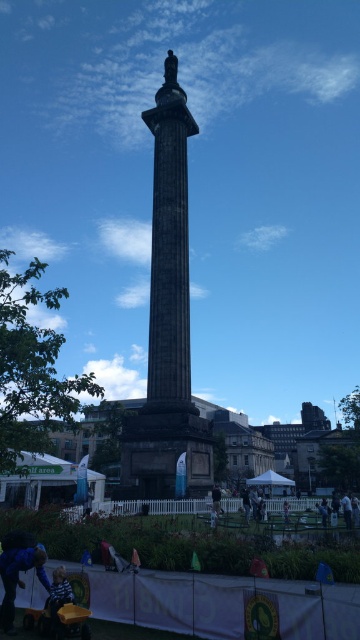
In the scene shown: You are a photographer planning to take a picture of the monument with the yellow plastic baby carriage at lower left and the dark blue fabric at center in the frame. Which object should you focus on first if you want to ensure both are in focus without adjusting the camera settings?

The yellow plastic baby carriage at lower left is smaller in size compared to the dark blue fabric at center, so focusing on the larger object first might help maintain focus on both.

You are a photographer trying to capture the monument in the background while ensuring both the yellow plastic baby carriage at lower left and the dark blue fabric at center are visible in your frame. Which object should you position closer to the edge of the frame to maintain the monument as the main focus?

Since the yellow plastic baby carriage at lower left has a lesser width compared to the dark blue fabric at center, positioning the yellow plastic baby carriage at lower left closer to the edge of the frame would allow it to fit within the composition while keeping the monument as the main focus.

You are standing at the monument and want to take a photo of the point at coordinate (x=37, y=561). If your camera has a maximum zoom range of 40 meters, can you capture the point clearly?

The point at coordinate (x=37, y=561) is 43.04 meters away from the camera, which exceeds the maximum zoom range of 40 meters. Therefore, the camera cannot capture the point clearly.